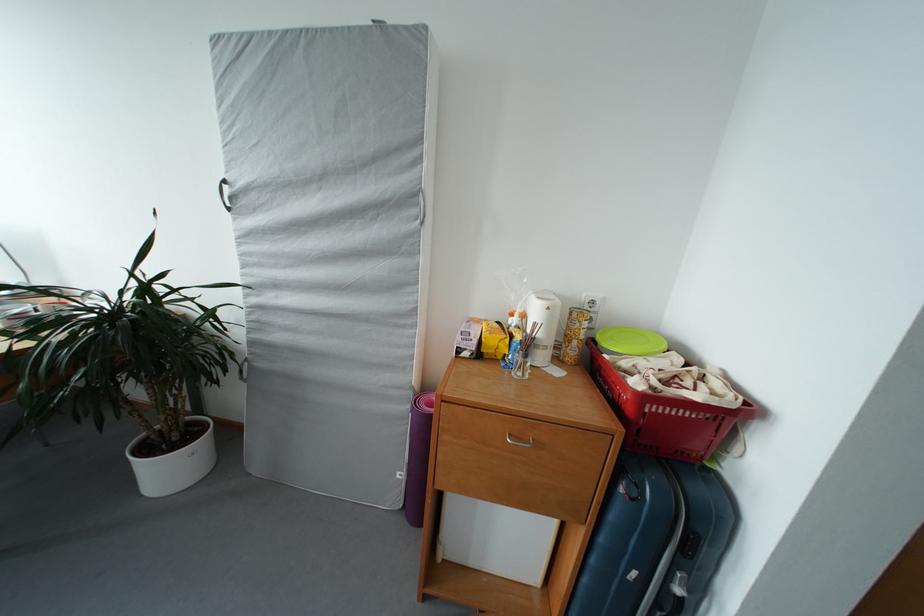
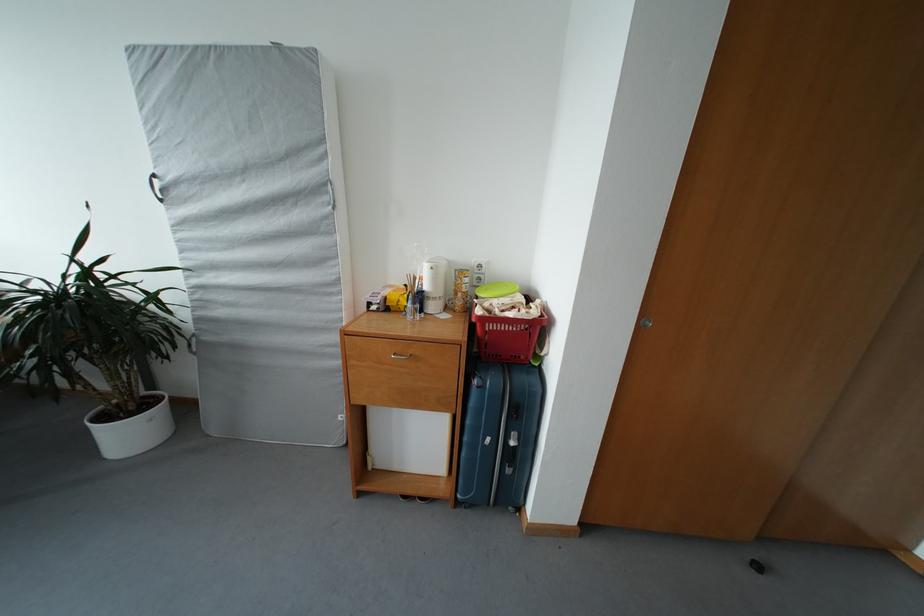
In the second image, find the point that corresponds to the point at 591,585 in the first image.

(469, 459)